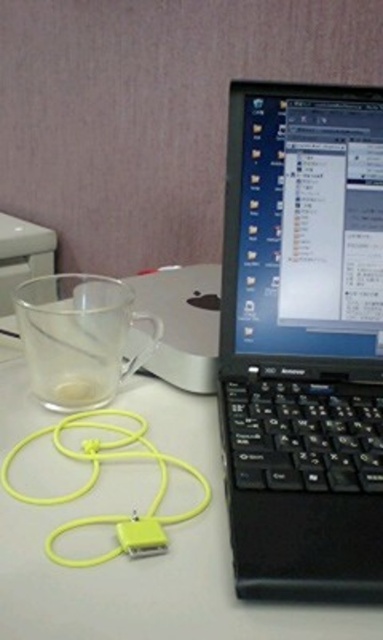
Question: Which point appears closest to the camera in this image?

Choices:
 (A) (253, 278)
 (B) (116, 483)
 (C) (147, 353)

Answer: (B)

Question: Which point is closer to the camera?

Choices:
 (A) (152, 440)
 (B) (76, 314)

Answer: (B)

Question: Which object is the farthest from the black plastic laptop at center?

Choices:
 (A) transparent glass at upper left
 (B) transparent glass cup at left

Answer: (B)

Question: Is black plastic laptop at center below transparent glass cup at left?

Choices:
 (A) yes
 (B) no

Answer: (B)

Question: Does black plastic laptop at center have a larger size compared to transparent glass cup at left?

Choices:
 (A) no
 (B) yes

Answer: (B)

Question: Is transparent glass at upper left bigger than transparent glass cup at left?

Choices:
 (A) no
 (B) yes

Answer: (B)